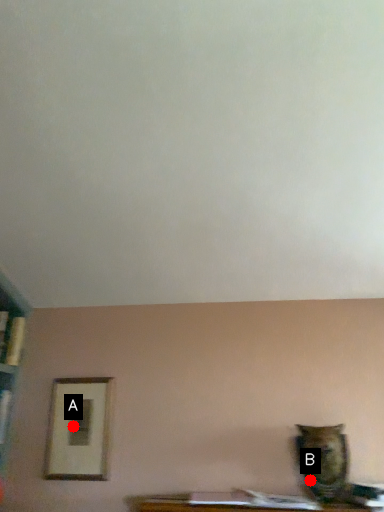
Question: Two points are circled on the image, labeled by A and B beside each circle. Which point is closer to the camera?

Choices:
 (A) A is closer
 (B) B is closer

Answer: (B)